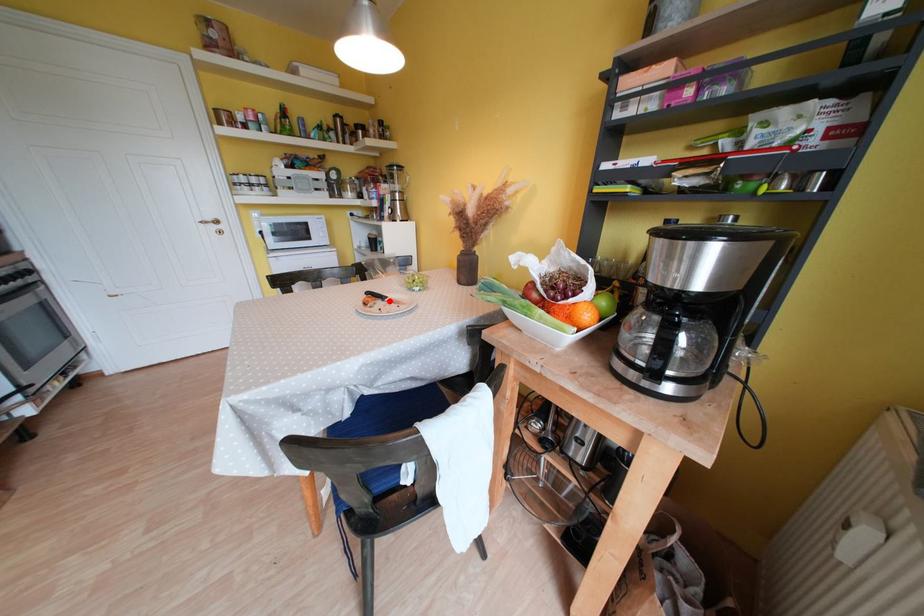
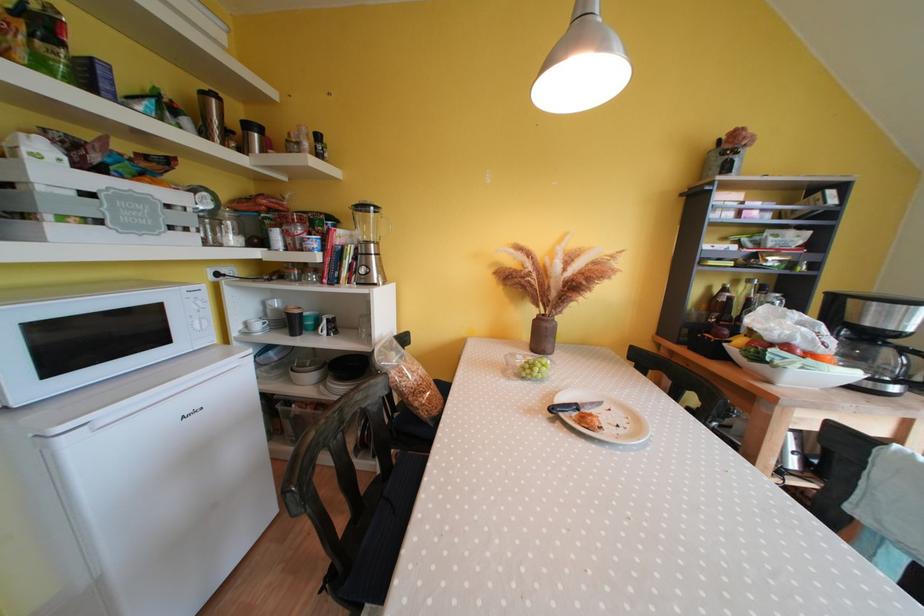
Locate, in the second image, the point that corresponds to the highlighted location in the first image.

(582, 410)